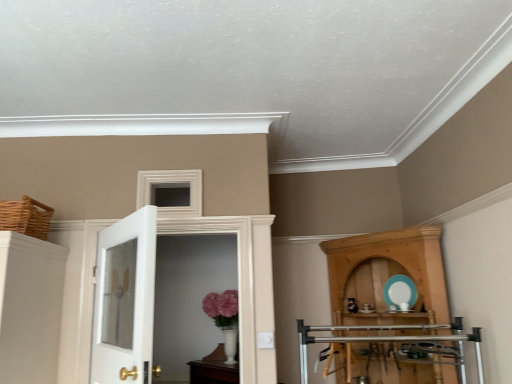
Question: Is woven brown basket at upper left at the left side of wooden cupboard at right?

Choices:
 (A) yes
 (B) no

Answer: (A)

Question: Considering the relative sizes of woven brown basket at upper left and wooden cupboard at right in the image provided, is woven brown basket at upper left shorter than wooden cupboard at right?

Choices:
 (A) no
 (B) yes

Answer: (B)

Question: Considering the relative sizes of woven brown basket at upper left and wooden cupboard at right in the image provided, is woven brown basket at upper left bigger than wooden cupboard at right?

Choices:
 (A) no
 (B) yes

Answer: (A)

Question: Does woven brown basket at upper left contain wooden cupboard at right?

Choices:
 (A) no
 (B) yes

Answer: (A)

Question: Is woven brown basket at upper left closer to the viewer compared to wooden cupboard at right?

Choices:
 (A) no
 (B) yes

Answer: (B)

Question: From the image's perspective, is woven brown basket at upper left above or below white glass door at left, the 1th door from the front?

Choices:
 (A) below
 (B) above

Answer: (B)

Question: Visually, is woven brown basket at upper left positioned to the left or to the right of white glass door at left, arranged as the 2th door when viewed from the back?

Choices:
 (A) right
 (B) left

Answer: (B)

Question: Does point (48, 218) appear closer or farther from the camera than point (153, 281)?

Choices:
 (A) closer
 (B) farther

Answer: (A)

Question: From their relative heights in the image, would you say woven brown basket at upper left is taller or shorter than white glass door at left, arranged as the 2th door when viewed from the back?

Choices:
 (A) short
 (B) tall

Answer: (A)

Question: From the image's perspective, is woven brown basket at upper left located above or below white glossy door at center, placed as the 2th door when sorted from front to back?

Choices:
 (A) above
 (B) below

Answer: (A)

Question: Considering the positions of point (42, 215) and point (240, 241), is point (42, 215) closer or farther from the camera than point (240, 241)?

Choices:
 (A) closer
 (B) farther

Answer: (A)

Question: From their relative heights in the image, would you say woven brown basket at upper left is taller or shorter than white glossy door at center, placed as the 2th door when sorted from front to back?

Choices:
 (A) tall
 (B) short

Answer: (B)

Question: From a real-world perspective, is woven brown basket at upper left above or below white glossy door at center, acting as the 1th door starting from the back?

Choices:
 (A) above
 (B) below

Answer: (A)

Question: Looking at their shapes, would you say woven brown basket at upper left is wider or thinner than wooden cupboard at right?

Choices:
 (A) thin
 (B) wide

Answer: (A)

Question: Is woven brown basket at upper left taller or shorter than wooden cupboard at right?

Choices:
 (A) short
 (B) tall

Answer: (A)